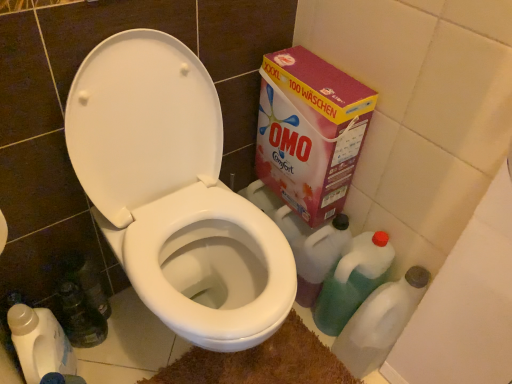
Question: Is pink cardboard box at upper right placed right next to translucent plastic bottle at lower right, which is the first cleaning product from right to left?

Choices:
 (A) no
 (B) yes

Answer: (A)

Question: From a real-world perspective, is pink cardboard box at upper right physically below translucent plastic bottle at lower right, which is the first cleaning product from right to left?

Choices:
 (A) no
 (B) yes

Answer: (A)

Question: From the image's perspective, is pink cardboard box at upper right below translucent plastic bottle at lower right, which is the first cleaning product from right to left?

Choices:
 (A) yes
 (B) no

Answer: (B)

Question: Is translucent plastic bottle at lower right, which is the 2th cleaning product from left to right, completely or partially inside pink cardboard box at upper right?

Choices:
 (A) no
 (B) yes

Answer: (A)

Question: Can you confirm if pink cardboard box at upper right is thinner than translucent plastic bottle at lower right, which is the first cleaning product from right to left?

Choices:
 (A) no
 (B) yes

Answer: (B)

Question: Is pink cardboard box at upper right facing towards translucent plastic bottle at lower right, which is the first cleaning product from right to left?

Choices:
 (A) yes
 (B) no

Answer: (B)

Question: Does translucent plastic bottle at lower right, which is the first cleaning product from right to left, have a lesser height compared to white glossy toilet at center?

Choices:
 (A) yes
 (B) no

Answer: (A)

Question: Can you confirm if translucent plastic bottle at lower right, which is the 2th cleaning product from left to right, is wider than white glossy toilet at center?

Choices:
 (A) no
 (B) yes

Answer: (A)

Question: Would you say translucent plastic bottle at lower right, which is the first cleaning product from right to left, contains white glossy toilet at center?

Choices:
 (A) yes
 (B) no

Answer: (B)

Question: Considering the relative positions of translucent plastic bottle at lower right, which is the first cleaning product from right to left, and white glossy toilet at center in the image provided, is translucent plastic bottle at lower right, which is the first cleaning product from right to left, to the left of white glossy toilet at center from the viewer's perspective?

Choices:
 (A) no
 (B) yes

Answer: (A)

Question: Is translucent plastic bottle at lower right, which is the first cleaning product from right to left, far away from white glossy toilet at center?

Choices:
 (A) yes
 (B) no

Answer: (B)

Question: Is translucent plastic bottle at lower right, which is the first cleaning product from right to left, further to camera compared to white glossy toilet at center?

Choices:
 (A) no
 (B) yes

Answer: (B)

Question: Does translucent plastic bottle at lower right, which is the 2th cleaning product from left to right, have a lesser width compared to pink cardboard box at upper right?

Choices:
 (A) yes
 (B) no

Answer: (B)